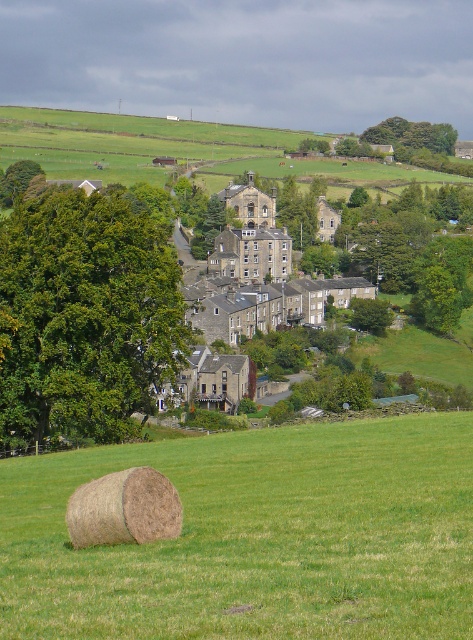
Can you confirm if green leafy tree at left is positioned to the right of brown straw bale at lower left?

Incorrect, green leafy tree at left is not on the right side of brown straw bale at lower left.

Is point (143, 317) more distant than point (146, 492)?

Yes.

Between point (75, 218) and point (112, 541), which one is positioned in front?

Point (112, 541) is more forward.

Locate an element on the screen. This screenshot has height=640, width=473. green leafy tree at left is located at coordinates (86, 314).

Can you confirm if brown hay bale at lower left is positioned to the left of green leafy tree at upper center?

Indeed, brown hay bale at lower left is positioned on the left side of green leafy tree at upper center.

Does brown hay bale at lower left have a greater width compared to green leafy tree at upper center?

In fact, brown hay bale at lower left might be narrower than green leafy tree at upper center.

Is point (78, 554) positioned behind point (426, 134)?

No, it is in front of (426, 134).

Image resolution: width=473 pixels, height=640 pixels. I want to click on brown hay bale at lower left, so click(x=255, y=538).

Consider the image. Is stone houses at center shorter than brown straw bale at lower left?

In fact, stone houses at center may be taller than brown straw bale at lower left.

Consider the image. Can you confirm if stone houses at center is positioned to the right of brown straw bale at lower left?

Correct, you'll find stone houses at center to the right of brown straw bale at lower left.

What do you see at coordinates (245, 285) in the screenshot?
I see `stone houses at center` at bounding box center [245, 285].

Where is `stone houses at center`? stone houses at center is located at coordinates (245, 285).